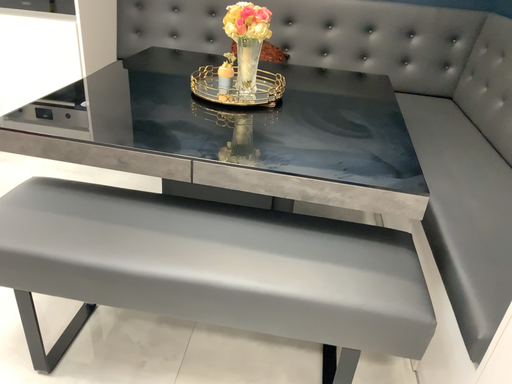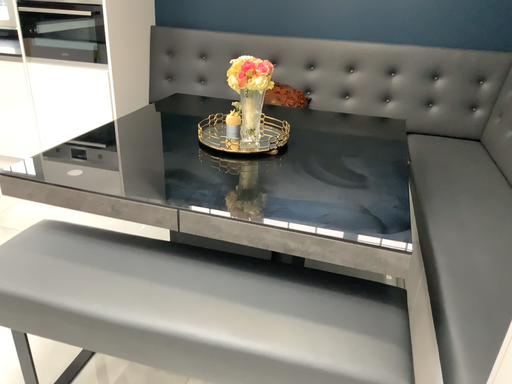
Question: How did the camera likely rotate when shooting the video?

Choices:
 (A) rotated right
 (B) rotated left

Answer: (B)